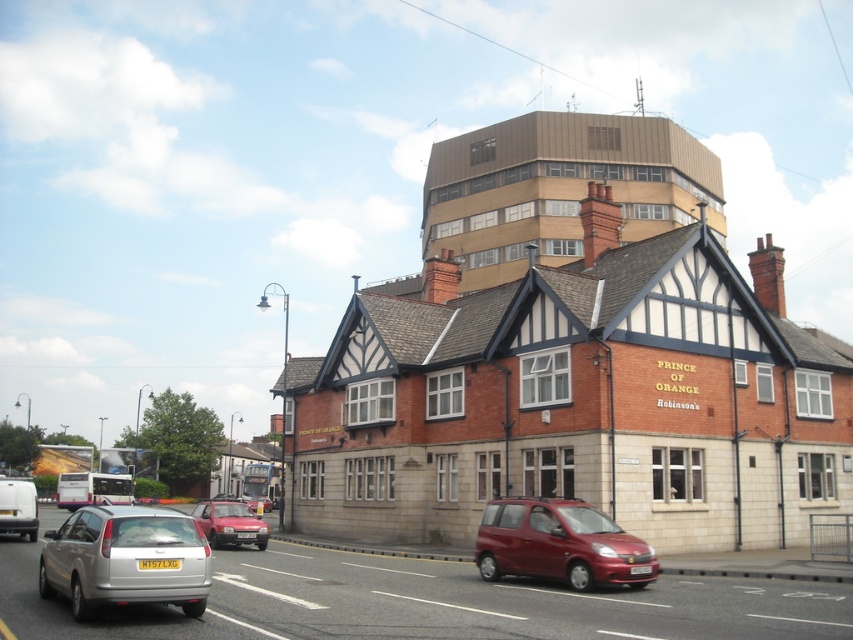
Question: Which object is positioned closest to the metallic red minivan at center?

Choices:
 (A) matte red car at center
 (B) silver metallic hatchback at lower left

Answer: (B)

Question: Which of the following is the closest to the observer?

Choices:
 (A) matte red car at center
 (B) metallic red minivan at center

Answer: (B)

Question: Considering the relative positions of metallic red minivan at center and matte red car at center in the image provided, where is metallic red minivan at center located with respect to matte red car at center?

Choices:
 (A) below
 (B) above

Answer: (B)

Question: Is silver metallic hatchback at lower left to the left of matte red car at center from the viewer's perspective?

Choices:
 (A) no
 (B) yes

Answer: (A)

Question: Considering the relative positions of silver metallic hatchback at lower left and metallic red minivan at center in the image provided, where is silver metallic hatchback at lower left located with respect to metallic red minivan at center?

Choices:
 (A) below
 (B) above

Answer: (A)

Question: Which of the following is the farthest from the observer?

Choices:
 (A) (482, 525)
 (B) (242, 534)
 (C) (67, 577)

Answer: (B)